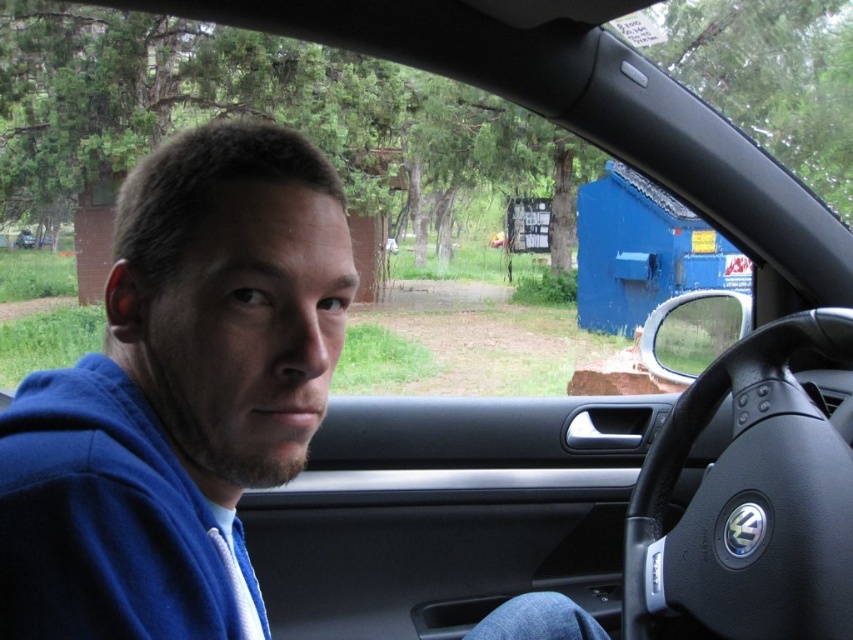
Question: Among these objects, which one is nearest to the camera?

Choices:
 (A) black leather steering wheel at center
 (B) matte black car at center

Answer: (A)

Question: Considering the real-world distances, which object is closest to the blue fleece jacket at left?

Choices:
 (A) blue fleece sweatshirt at left
 (B) black leather steering wheel at center
 (C) matte black car at center

Answer: (A)

Question: Is black leather steering wheel at center above matte black car at center?

Choices:
 (A) no
 (B) yes

Answer: (A)

Question: Based on their relative distances, which object is farther from the blue fleece sweatshirt at left?

Choices:
 (A) matte black car at center
 (B) blue fleece jacket at left

Answer: (A)

Question: Does blue fleece jacket at left appear over matte black car at center?

Choices:
 (A) yes
 (B) no

Answer: (B)

Question: In this image, where is blue fleece sweatshirt at left located relative to matte black car at center?

Choices:
 (A) above
 (B) below

Answer: (B)